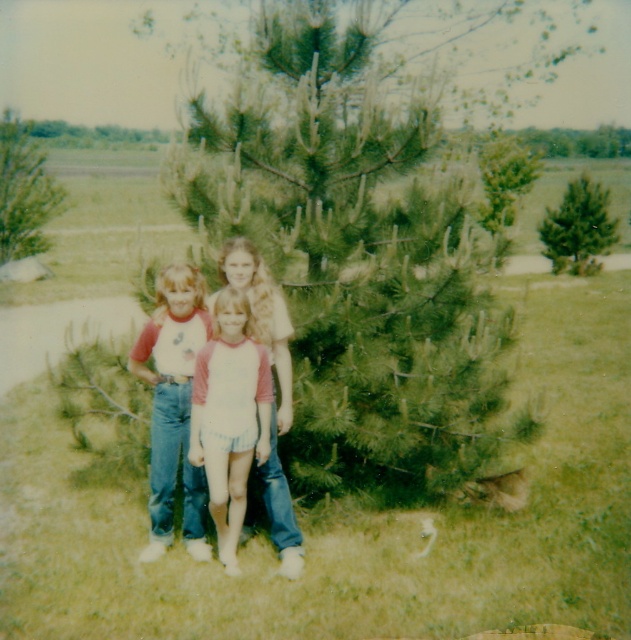
Does denim jeans at center appear over green matte pine at upper right?

No.

Between point (146, 381) and point (593, 220), which one is positioned in front?

Point (146, 381) is in front.

The image size is (631, 640). What are the coordinates of `denim jeans at center` in the screenshot? It's located at (174, 406).

Looking at this image, which of these two, denim jeans at center or green leafy tree at upper left, stands shorter?

With less height is denim jeans at center.

Who is higher up, denim jeans at center or green leafy tree at upper left?

Positioned higher is green leafy tree at upper left.

Where is `denim jeans at center`? denim jeans at center is located at coordinates (174, 406).

Identify the location of denim jeans at center. (174, 406).

Locate an element on the screen. The image size is (631, 640). green leafy tree at upper left is located at coordinates (x=23, y=192).

Describe the element at coordinates (23, 192) in the screenshot. The width and height of the screenshot is (631, 640). I see `green leafy tree at upper left` at that location.

This screenshot has height=640, width=631. I want to click on green leafy tree at upper left, so click(23, 192).